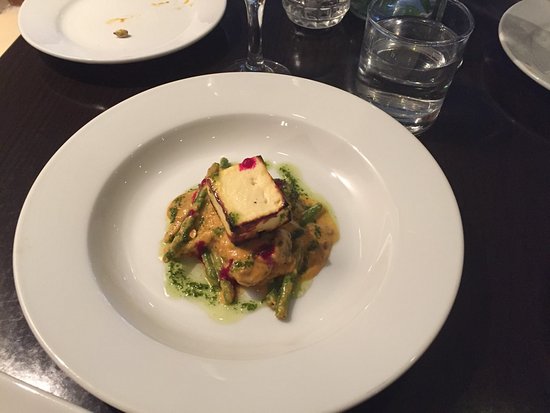
Where is `glass`? The image size is (550, 413). glass is located at coordinates (421, 36).